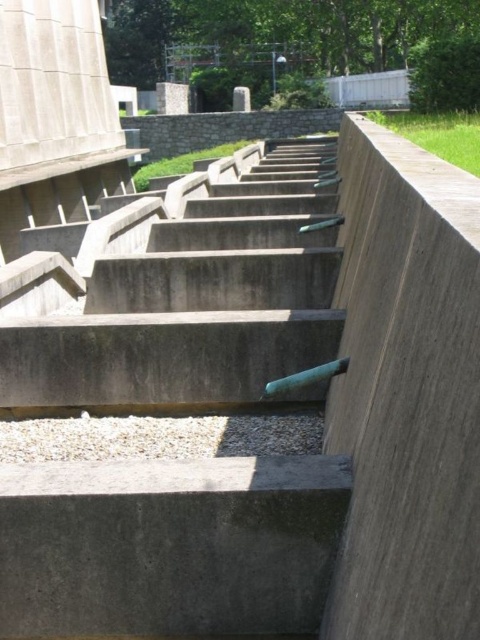
You are standing at the bottom of the steps and want to reach the top. There are two points marked on the steps. Which point is closer to you, point (11, 307) or point (64, 508)?

Point (11, 307) is closer to you because it is further to the viewer than point (64, 508), meaning it is nearer in your line of sight.

You are standing on the gray concrete at center and want to climb up to the concrete stairs at center. Are you able to reach them directly from your current position?

The concrete stairs at center is positioned over gray concrete at center, so yes, you can reach them directly from your current position on the gray concrete at center.

You are standing at point (183, 292) in the image. What object is directly beneath your feet?

The concrete stairs at center are directly beneath your feet at point (183, 292).